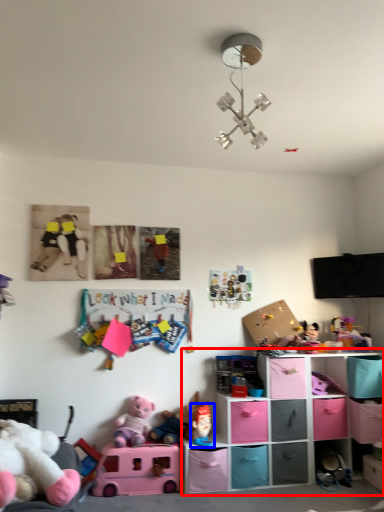
Question: Which point is closer to the camera, shelf (highlighted by a red box) or toy (highlighted by a blue box)?

Choices:
 (A) shelf
 (B) toy

Answer: (A)